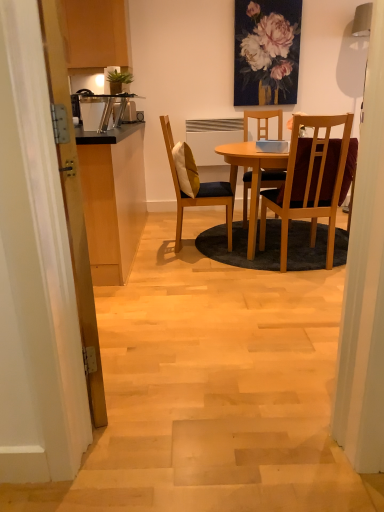
What is the approximate width of yellow fabric pillow at center?

It is 7.83 inches.

What do you see at coordinates (253, 164) in the screenshot? I see `wooden table at center` at bounding box center [253, 164].

Image resolution: width=384 pixels, height=512 pixels. I want to click on matte floral painting at upper center, so click(267, 52).

Where is `yellow fabric pillow at center`? This screenshot has width=384, height=512. yellow fabric pillow at center is located at coordinates (186, 169).

Which object is positioned more to the right, yellow fabric pillow at center or matte floral painting at upper center?

From the viewer's perspective, matte floral painting at upper center appears more on the right side.

Who is shorter, yellow fabric pillow at center or matte floral painting at upper center?

yellow fabric pillow at center is shorter.

Where is `floral arrangement positioned vertically above the yellow fabric pillow at center (from a real-world perspective)`? Image resolution: width=384 pixels, height=512 pixels. floral arrangement positioned vertically above the yellow fabric pillow at center (from a real-world perspective) is located at coordinates (x=267, y=52).

Based on their sizes in the image, would you say wooden door at left is bigger or smaller than wooden table at center?

Considering their sizes, wooden door at left takes up less space than wooden table at center.

In the scene shown: Considering the sizes of objects wooden door at left and wooden table at center in the image provided, who is thinner, wooden door at left or wooden table at center?

wooden door at left is thinner.

Which point is more forward, (80, 223) or (176, 192)?

The point (80, 223) is closer.

Is wooden door at left oriented towards wooden table at center?

No, wooden door at left is not oriented towards wooden table at center.

From the image's perspective, is wooden chair with cushion at center, acting as the first chair starting from the left, below wooden door at left?

Incorrect, from the image's perspective, wooden chair with cushion at center, acting as the first chair starting from the left, is higher than wooden door at left.

Considering the relative positions of wooden chair with cushion at center, acting as the first chair starting from the left, and wooden door at left in the image provided, is wooden chair with cushion at center, acting as the first chair starting from the left, in front of wooden door at left?

No, it is not.

Measure the distance from wooden chair with cushion at center, acting as the first chair starting from the left, to wooden door at left.

They are 1.78 meters apart.

In terms of height, does wooden chair with cushion at center, acting as the first chair starting from the left, look taller or shorter compared to wooden door at left?

Clearly, wooden chair with cushion at center, acting as the first chair starting from the left, is shorter compared to wooden door at left.

What's the angular difference between wooden chair with dark cushioning at center, which ranks as the 1th chair in right-to-left order, and yellow fabric pillow at center's facing directions?

87.1 degrees separate the facing orientations of wooden chair with dark cushioning at center, which ranks as the 1th chair in right-to-left order, and yellow fabric pillow at center.

Can you see wooden chair with dark cushioning at center, the second chair from the left, touching yellow fabric pillow at center?

They are not placed beside each other.

Between wooden chair with dark cushioning at center, the second chair from the left, and yellow fabric pillow at center, which one has smaller size?

yellow fabric pillow at center.

Locate an element on the screen. The image size is (384, 512). pillow above the wooden chair with dark cushioning at center, which ranks as the 1th chair in right-to-left order (from a real-world perspective) is located at coordinates (186, 169).

Is wooden door at left touching yellow fabric pillow at center?

wooden door at left and yellow fabric pillow at center are clearly separated.

In the scene shown: Is yellow fabric pillow at center a part of wooden door at left?

No, yellow fabric pillow at center is located outside of wooden door at left.

Consider the image. From the image's perspective, which object appears higher, wooden door at left or yellow fabric pillow at center?

From the image's view, yellow fabric pillow at center is above.

From the image's perspective, is wooden door at left over wooden chair with cushion at center, positioned as the 2th chair in right-to-left order?

No, from the image's perspective, wooden door at left is not above wooden chair with cushion at center, positioned as the 2th chair in right-to-left order.

Is wooden door at left spatially inside wooden chair with cushion at center, acting as the first chair starting from the left, or outside of it?

wooden door at left exists outside the volume of wooden chair with cushion at center, acting as the first chair starting from the left.

Can you confirm if wooden door at left is thinner than wooden chair with cushion at center, acting as the first chair starting from the left?

Indeed, wooden door at left has a lesser width compared to wooden chair with cushion at center, acting as the first chair starting from the left.

Where is `chair that is the 2nd one below the matte floral painting at upper center (from a real-world perspective)`? chair that is the 2nd one below the matte floral painting at upper center (from a real-world perspective) is located at coordinates (198, 191).

Can you confirm if wooden chair with cushion at center, acting as the first chair starting from the left, is positioned to the right of matte floral painting at upper center?

No, wooden chair with cushion at center, acting as the first chair starting from the left, is not to the right of matte floral painting at upper center.

How much distance is there between wooden chair with cushion at center, positioned as the 2th chair in right-to-left order, and matte floral painting at upper center?

wooden chair with cushion at center, positioned as the 2th chair in right-to-left order, and matte floral painting at upper center are 5.05 feet apart.

Does point (198, 196) appear closer or farther from the camera than point (241, 93)?

Point (198, 196) is positioned closer to the camera compared to point (241, 93).

The width and height of the screenshot is (384, 512). In order to click on pillow that is on the left side of matte floral painting at upper center in this screenshot , I will do `click(186, 169)`.

At what (x,y) coordinates should I click in order to perform the action: click on kitchen & dining room table above the wooden door at left (from the image's perspective). Please return your answer as a coordinate pair (x, y). Image resolution: width=384 pixels, height=512 pixels. Looking at the image, I should click on coord(253,164).

Based on their spatial positions, is wooden table at center or wooden chair with cushion at center, acting as the first chair starting from the left, further from yellow fabric pillow at center?

Among the two, wooden table at center is located further to yellow fabric pillow at center.

Considering their positions, is wooden table at center positioned further to matte floral painting at upper center than yellow fabric pillow at center?

yellow fabric pillow at center is positioned further to the anchor matte floral painting at upper center.

When comparing their distances from wooden table at center, does wooden door at left or matte floral painting at upper center seem closer?

matte floral painting at upper center is positioned closer to the anchor wooden table at center.

Based on their spatial positions, is wooden table at center or wooden door at left further from wooden chair with cushion at center, acting as the first chair starting from the left?

Based on the image, wooden door at left appears to be further to wooden chair with cushion at center, acting as the first chair starting from the left.

Consider the image. Which object lies nearer to the anchor point wooden chair with dark cushioning at center, which ranks as the 1th chair in right-to-left order, wooden table at center or wooden chair with cushion at center, positioned as the 2th chair in right-to-left order?

wooden table at center is positioned closer to the anchor wooden chair with dark cushioning at center, which ranks as the 1th chair in right-to-left order.

Looking at the image, which one is located further to yellow fabric pillow at center, wooden chair with cushion at center, acting as the first chair starting from the left, or matte floral painting at upper center?

matte floral painting at upper center is positioned further to the anchor yellow fabric pillow at center.

Estimate the real-world distances between objects in this image. Which object is closer to wooden chair with cushion at center, positioned as the 2th chair in right-to-left order, matte floral painting at upper center or yellow fabric pillow at center?

Among the two, yellow fabric pillow at center is located nearer to wooden chair with cushion at center, positioned as the 2th chair in right-to-left order.

Estimate the real-world distances between objects in this image. Which object is closer to wooden table at center, wooden chair with cushion at center, acting as the first chair starting from the left, or matte floral painting at upper center?

wooden chair with cushion at center, acting as the first chair starting from the left, lies closer to wooden table at center than the other object.

Locate an element on the screen. The height and width of the screenshot is (512, 384). pillow between wooden door at left and matte floral painting at upper center in the front-back direction is located at coordinates (186, 169).

Where is `chair between wooden chair with cushion at center, positioned as the 2th chair in right-to-left order, and wooden table at center`? chair between wooden chair with cushion at center, positioned as the 2th chair in right-to-left order, and wooden table at center is located at coordinates (310, 182).

Identify the location of chair between wooden door at left and wooden table at center from front to back. (310, 182).

Find the location of a particular element. The image size is (384, 512). kitchen & dining room table between matte floral painting at upper center and wooden chair with dark cushioning at center, which ranks as the 1th chair in right-to-left order, in the vertical direction is located at coordinates (253, 164).